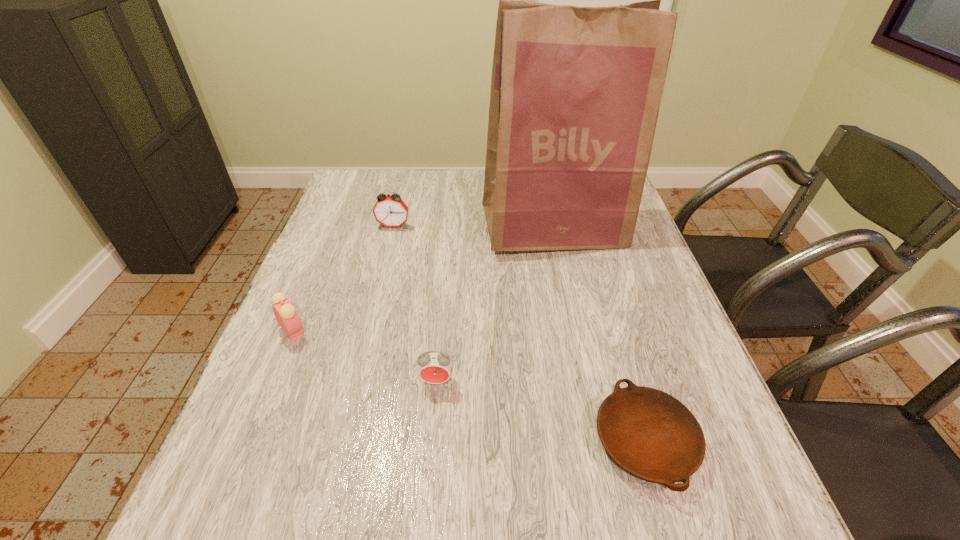
Identify the location of vacant space located on the clock face of the fourth shortest object. The image size is (960, 540). (373, 308).

Image resolution: width=960 pixels, height=540 pixels. Find the location of `vacant point located 0.200m on the face of the second nearest object`. vacant point located 0.200m on the face of the second nearest object is located at coordinates (427, 492).

Locate an element on the screen. The image size is (960, 540). free space located on the face of the second nearest alarm clock is located at coordinates (480, 331).

I want to click on free spot located on the left of the nearest object, so click(472, 441).

Identify the location of object located at the far edge. 575,93.

The height and width of the screenshot is (540, 960). I want to click on object at the near edge, so click(650, 434).

Where is `grocery bag that is positioned at the right edge`? This screenshot has width=960, height=540. grocery bag that is positioned at the right edge is located at coordinates pos(575,93).

At what (x,y) coordinates should I click in order to perform the action: click on plate that is at the right edge. Please return your answer as a coordinate pair (x, y). This screenshot has width=960, height=540. Looking at the image, I should click on (650, 434).

Locate an element on the screen. Image resolution: width=960 pixels, height=540 pixels. object at the far right corner is located at coordinates (575, 93).

You are a GUI agent. You are given a task and a screenshot of the screen. Output one action in this format:
    pyautogui.click(x=<x>, y=<y>)
    Task: Click on the object located in the near right corner section of the desktop
    The image size is (960, 540).
    Given the screenshot: What is the action you would take?
    pyautogui.click(x=650, y=434)